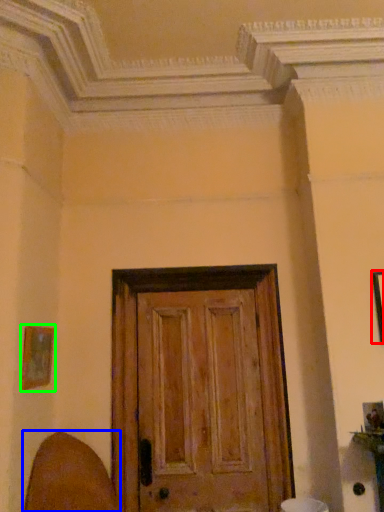
Question: Considering the real-world distances, which object is farthest from picture frame (highlighted by a red box)? swivel chair (highlighted by a blue box) or picture frame (highlighted by a green box)?

Choices:
 (A) swivel chair
 (B) picture frame

Answer: (A)